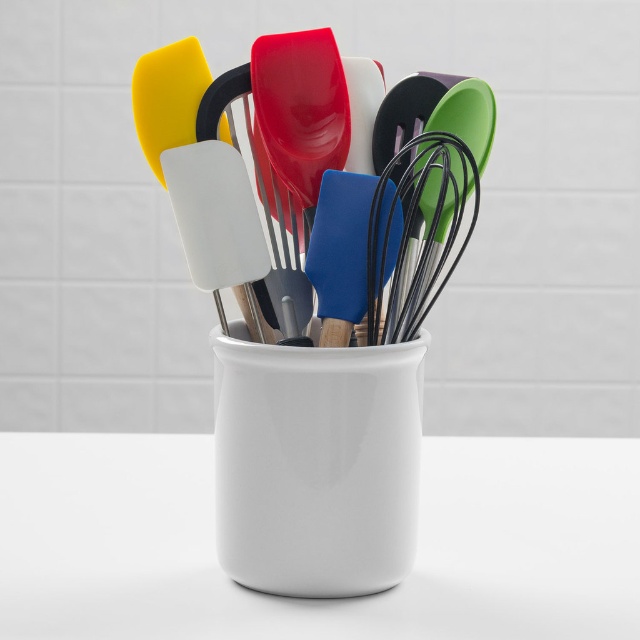
Who is more distant from viewer, (412, 268) or (195, 64)?

Point (412, 268)

Which is in front, point (385, 193) or point (182, 96)?

Point (385, 193)

I want to click on black wire whisk at center, so click(x=422, y=234).